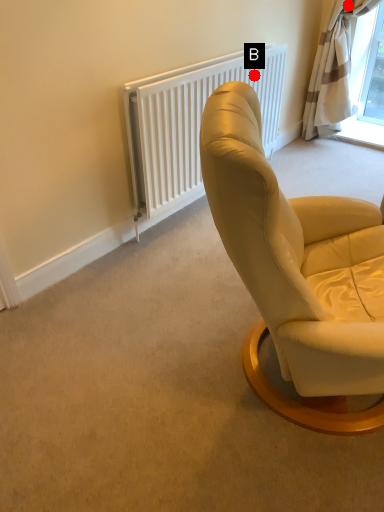
Question: Two points are circled on the image, labeled by A and B beside each circle. Which of the following is the closest to the observer?

Choices:
 (A) A is closer
 (B) B is closer

Answer: (B)